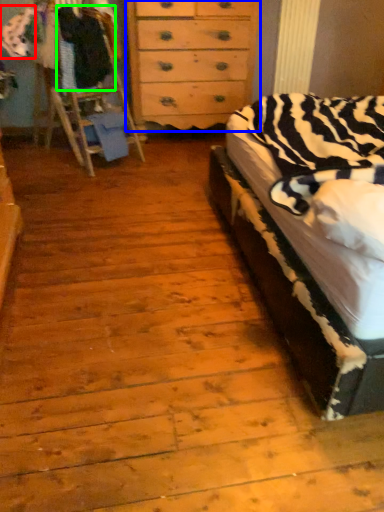
Question: Which object is the farthest from clothing (highlighted by a red box)? Choose among these: chest of drawers (highlighted by a blue box) or clothing (highlighted by a green box).

Choices:
 (A) chest of drawers
 (B) clothing

Answer: (A)